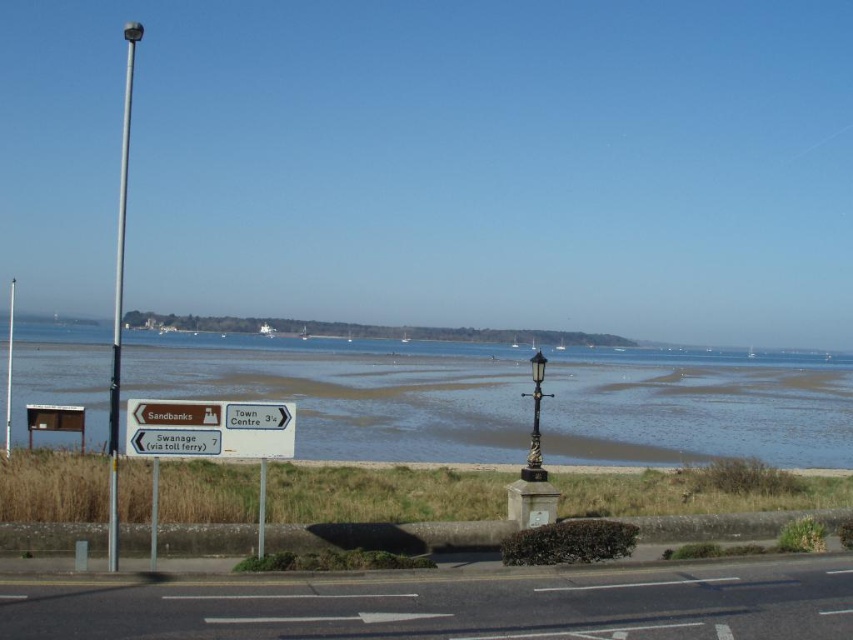
You are standing at the point marked by the coordinates [535,422]. Looking towards the signpost, which direction would you face?

The point at [535,422] marks the location of the polished brass lamp post at center. Since the signpost is on the left side of the road, facing towards it from the lamp post would mean turning to your left.

You are standing on the paved road with white lane markings and want to walk towards the water. Which direction should you go to reach the clear water at lower center first, considering the brown sand at lower center is between you and the water?

The clear water at lower center is wider than the brown sand at lower center, so you should walk towards the direction where the brown sand at lower center is narrower, allowing you to reach the clear water at lower center more quickly.